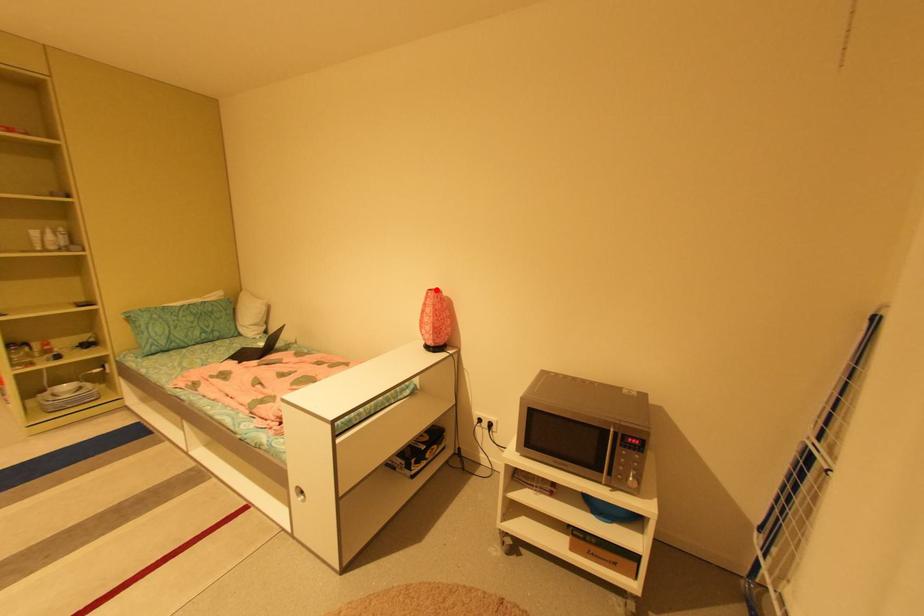
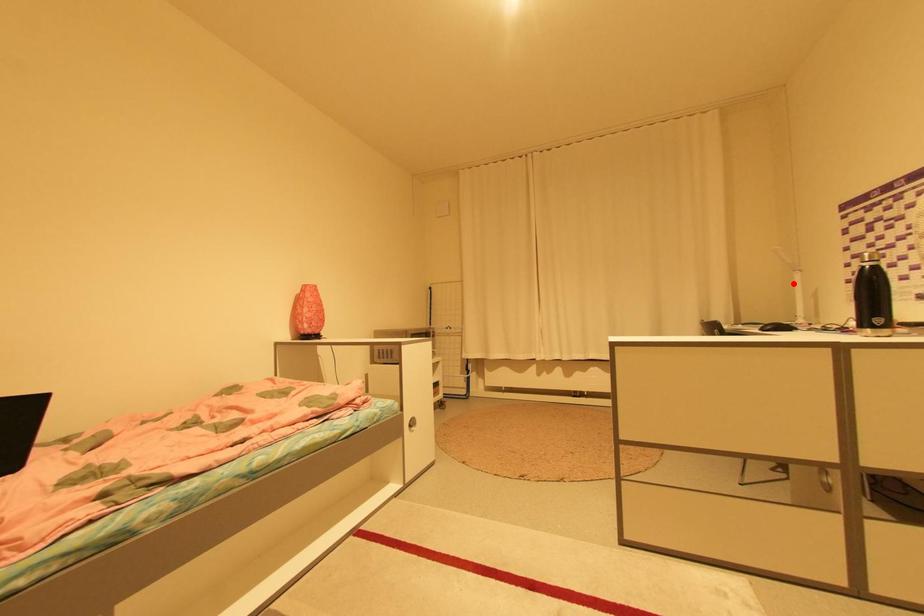
I am providing you with two images of the same scene from different viewpoints. A red point is marked on the first image and another point is marked on the second image. Does the point marked in image1 correspond to the same location as the one in image2?

No